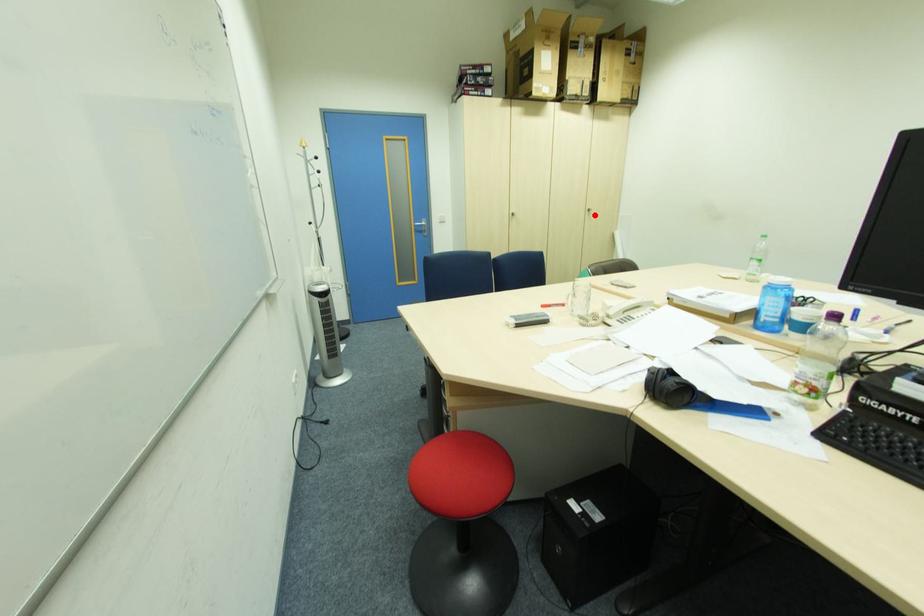
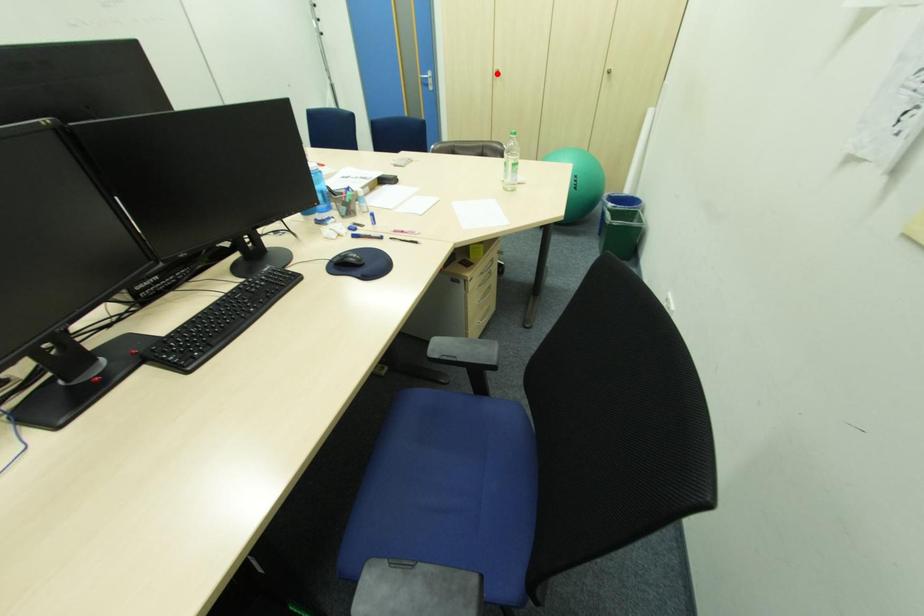
I am providing you with two images of the same scene from different viewpoints. A red point is marked on the first image and another point is marked on the second image. Is the red point in image1 aligned with the point shown in image2?

No